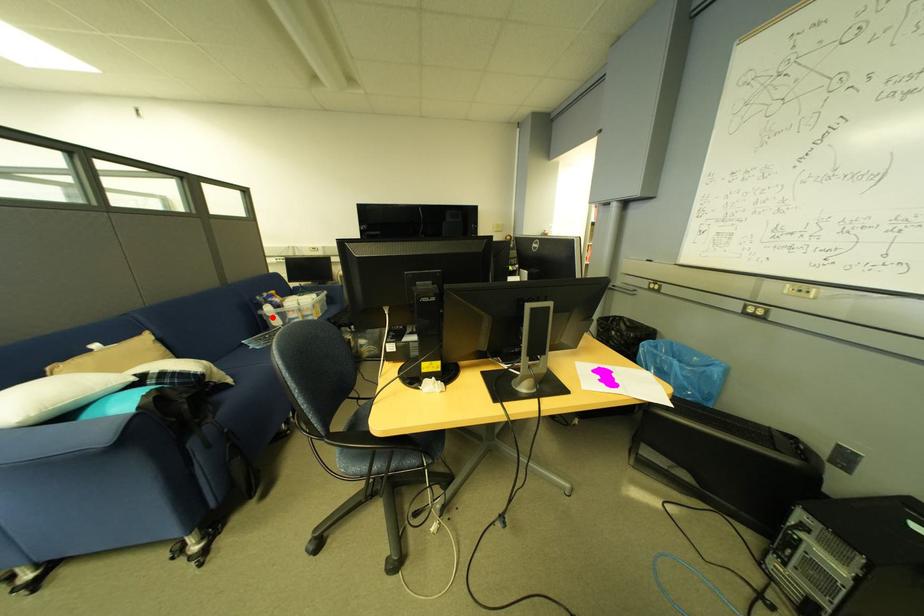
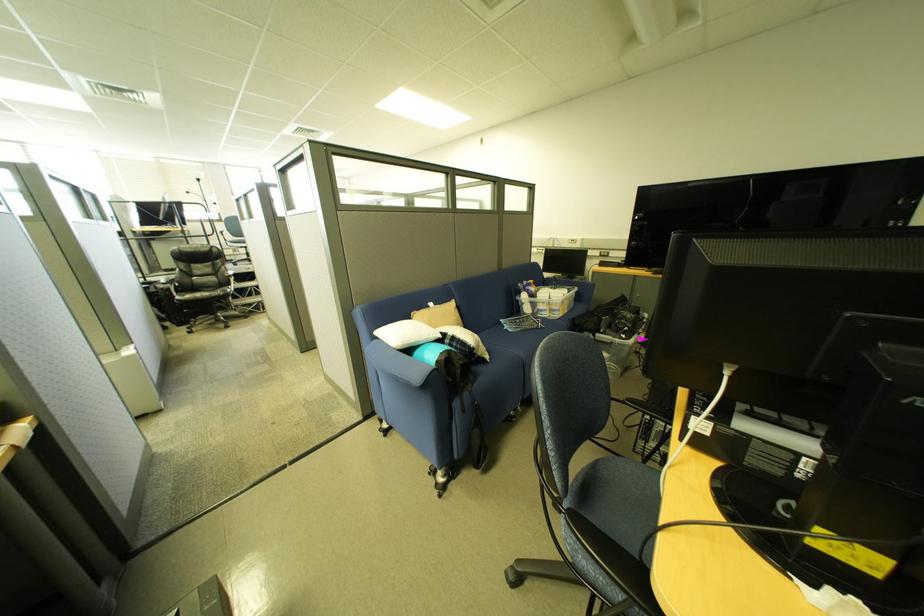
Locate, in the second image, the point that corresponds to the highlighted location in the first image.

(529, 302)